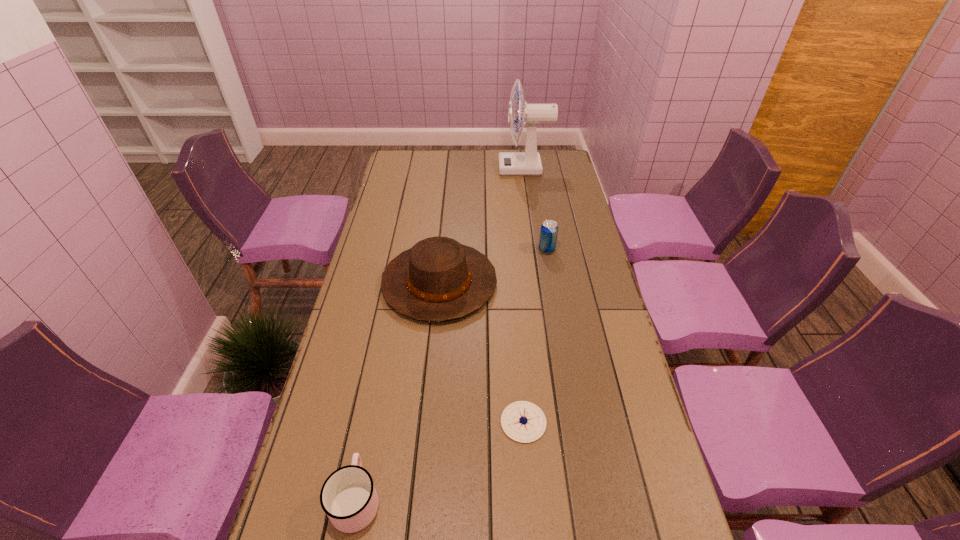
At what (x,y) coordinates should I click in order to perform the action: click on vacant region located on the front-facing side of the farthest object. Please return your answer as a coordinate pair (x, y). The height and width of the screenshot is (540, 960). Looking at the image, I should click on (476, 168).

At what (x,y) coordinates should I click in order to perform the action: click on free space located on the back of the cowboy hat. Please return your answer as a coordinate pair (x, y). The height and width of the screenshot is (540, 960). Looking at the image, I should click on (448, 195).

I want to click on free space located on the front of the beer can, so click(556, 300).

At what (x,y) coordinates should I click in order to perform the action: click on free location located 0.380m on the side of the fourth tallest object with the handle. Please return your answer as a coordinate pair (x, y). The image size is (960, 540). Looking at the image, I should click on (387, 342).

Find the location of `vacant space located 0.120m on the side of the fourth tallest object with the handle`. vacant space located 0.120m on the side of the fourth tallest object with the handle is located at coordinates (372, 421).

You are a GUI agent. You are given a task and a screenshot of the screen. Output one action in this format:
    pyautogui.click(x=<x>, y=<y>)
    Task: Click on the vacant area situated on the side of the fourth tallest object with the handle
    
    Given the screenshot: What is the action you would take?
    pyautogui.click(x=385, y=350)

I want to click on free region located 0.340m on the left of the second nearest object, so click(370, 422).

The height and width of the screenshot is (540, 960). In order to click on object present at the far edge in this screenshot , I will do pos(528,163).

At what (x,y) coordinates should I click in order to perform the action: click on cowboy hat situated at the left edge. Please return your answer as a coordinate pair (x, y). Looking at the image, I should click on (439, 279).

Find the location of a particular element. The width and height of the screenshot is (960, 540). mug situated at the left edge is located at coordinates (348, 496).